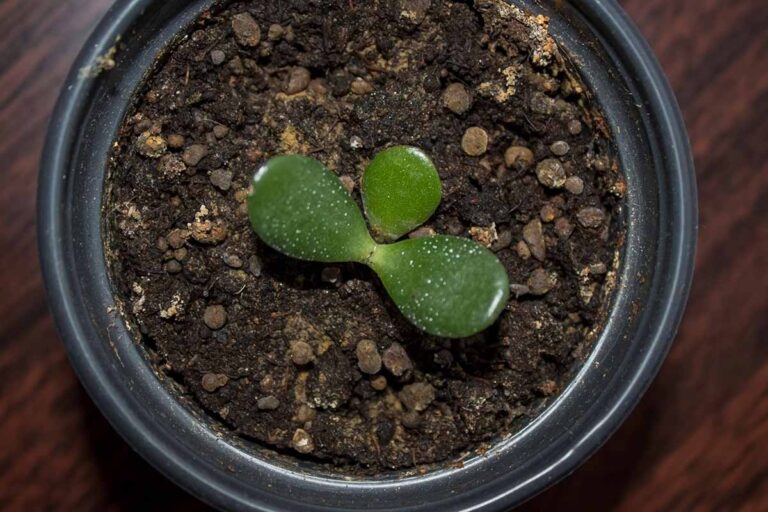
At what (x,y) coordinates should I click in order to perform the action: click on plant pot. Please return your answer as a coordinate pair (x, y). This screenshot has width=768, height=512. Looking at the image, I should click on pos(644,309).